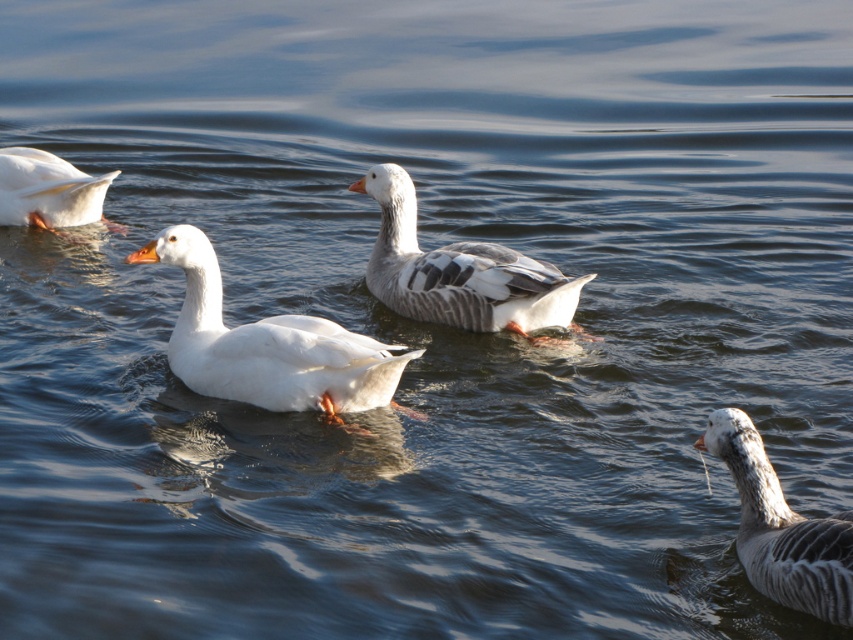
Question: Which is farther from the gray speckled duck at lower right?

Choices:
 (A) white matte duck at left
 (B) gray speckled duck at center

Answer: (A)

Question: Is gray speckled duck at center bigger than white matte duck at left?

Choices:
 (A) yes
 (B) no

Answer: (A)

Question: Which object appears farthest from the camera in this image?

Choices:
 (A) gray speckled duck at center
 (B) gray speckled duck at lower right
 (C) white matte duck at center

Answer: (A)

Question: Based on their relative distances, which object is farther from the white matte duck at center?

Choices:
 (A) white matte duck at left
 (B) gray speckled duck at lower right
 (C) gray speckled duck at center

Answer: (A)

Question: In this image, where is gray speckled duck at center located relative to gray speckled duck at lower right?

Choices:
 (A) left
 (B) right

Answer: (A)

Question: Does white matte duck at center appear over gray speckled duck at lower right?

Choices:
 (A) yes
 (B) no

Answer: (A)